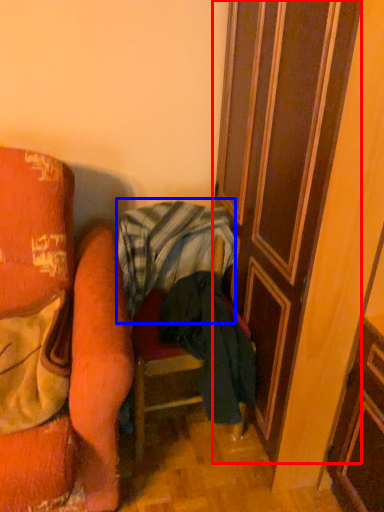
Question: Which object is closer to the camera taking this photo, door (highlighted by a red box) or blanket (highlighted by a blue box)?

Choices:
 (A) door
 (B) blanket

Answer: (A)